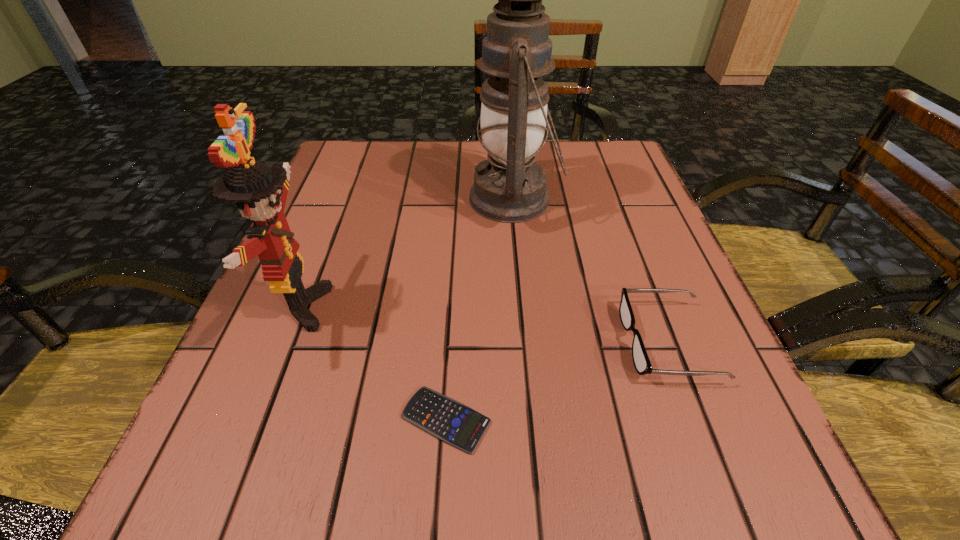
The width and height of the screenshot is (960, 540). Find the location of `vacant area that lies between the spectacles and the nutcracker`. vacant area that lies between the spectacles and the nutcracker is located at coordinates (484, 325).

Locate an element on the screen. This screenshot has width=960, height=540. unoccupied position between the oil lamp and the third tallest object is located at coordinates (590, 271).

I want to click on free spot between the calculator and the spectacles, so click(x=557, y=381).

What are the coordinates of `free space between the oil lamp and the second tallest object` in the screenshot? It's located at (407, 253).

This screenshot has height=540, width=960. What are the coordinates of `unoccupied area between the nearest object and the rightmost object` in the screenshot? It's located at (557, 381).

This screenshot has height=540, width=960. I want to click on object that is the third closest to the rightmost object, so click(x=260, y=190).

Where is `object that stands as the second closest to the shortest object`? The width and height of the screenshot is (960, 540). object that stands as the second closest to the shortest object is located at coordinates (641, 361).

Find the location of a particular element. Image resolution: width=960 pixels, height=540 pixels. free space that satisfies the following two spatial constraints: 1. on the back side of the nearest object; 2. on the front-facing side of the nutcracker is located at coordinates (453, 307).

At what (x,y) coordinates should I click in order to perform the action: click on blank space that satisfies the following two spatial constraints: 1. on the front side of the tallest object; 2. on the front-facing side of the leftmost object. Please return your answer as a coordinate pair (x, y). The height and width of the screenshot is (540, 960). Looking at the image, I should click on click(524, 307).